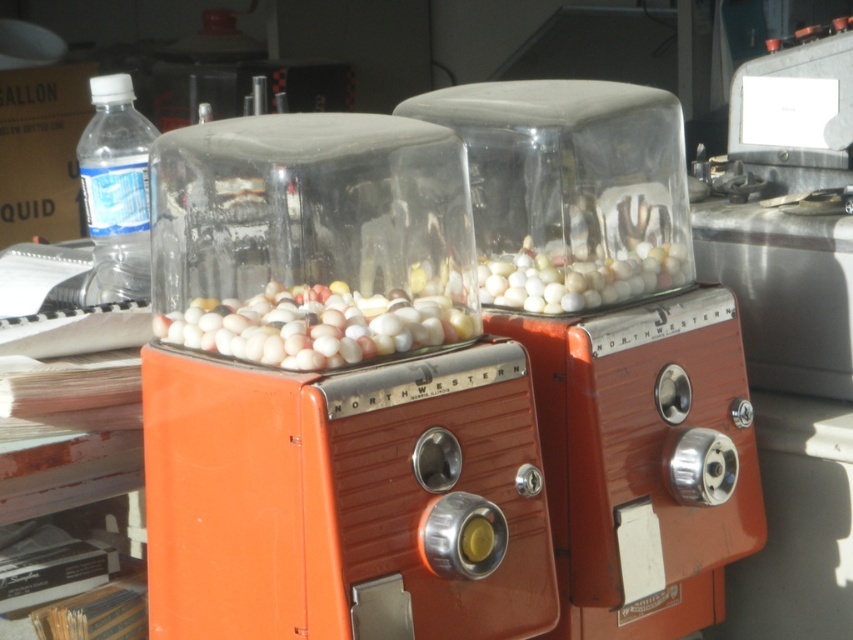
You are standing in front of two orange metallic gumball machines. The first one is labeled as the orange metallic gumball machine at center, and the second one is the orange metallic northwestern gumball machine at center. Which machine is positioned to the left?

The orange metallic gumball machine at center is positioned to the left of the orange metallic northwestern gumball machine at center.

You are standing in front of two vintage Northwestern gumball machines placed side by side. You notice two points marked in the image, one at coordinates point (x=581, y=468) and the other at point (x=102, y=232). Which point is closer to you?

Point (x=581, y=468) is in front of point (x=102, y=232), so the point at (x=581, y=468) is closer to you.

You are standing in front of the orange metallic northwestern gumball machine at center. You want to reach into your pocket to grab your keys, which are 3 feet away from the camera. Can you do this without moving your position?

The orange metallic northwestern gumball machine at center is 5.59 feet away from camera. Since your keys are only 3 feet away from the camera, they are closer to you than the machine. Therefore, you can reach them without moving your position.